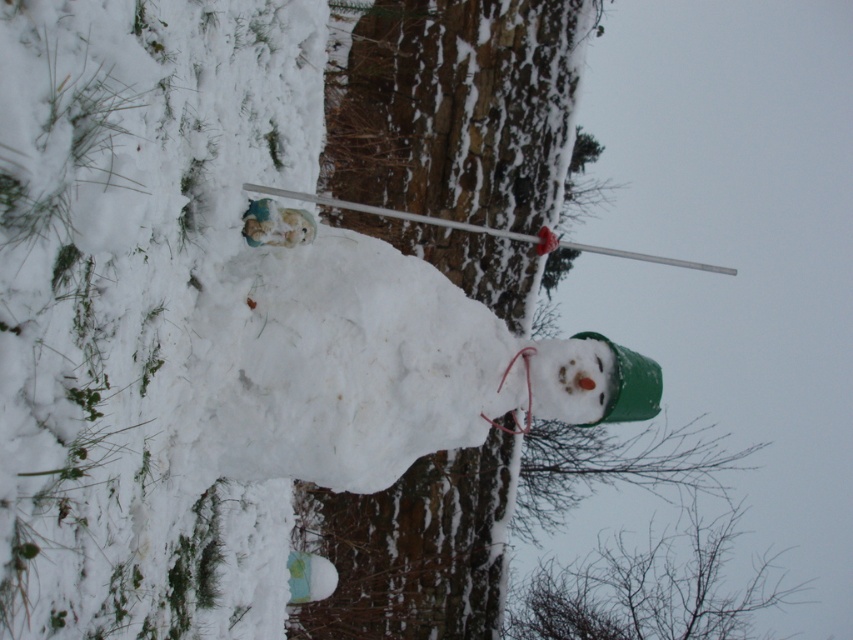
Is green matte snowman at center taller than silvery branches at lower right?

Yes, green matte snowman at center is taller than silvery branches at lower right.

Who is lower down, green matte snowman at center or silvery branches at lower right?

silvery branches at lower right is lower down.

What do you see at coordinates (457, 108) in the screenshot? The width and height of the screenshot is (853, 640). I see `green matte snowman at center` at bounding box center [457, 108].

Locate an element on the screen. green matte snowman at center is located at coordinates (457, 108).

This screenshot has width=853, height=640. What do you see at coordinates (648, 586) in the screenshot?
I see `silvery branches at lower right` at bounding box center [648, 586].

Looking at this image, between silvery branches at lower right and white plastic ski pole at upper center, which one is positioned lower?

silvery branches at lower right

Is point (614, 637) closer to camera compared to point (277, 189)?

No, it is not.

Where is `silvery branches at lower right`? Image resolution: width=853 pixels, height=640 pixels. silvery branches at lower right is located at coordinates (648, 586).

Who is positioned more to the left, green matte snowman at center or white plastic ski pole at upper center?

green matte snowman at center

Looking at this image, does green matte snowman at center appear under white plastic ski pole at upper center?

Correct, green matte snowman at center is located below white plastic ski pole at upper center.

Is point (372, 589) closer to viewer compared to point (473, 225)?

Yes, point (372, 589) is in front of point (473, 225).

Image resolution: width=853 pixels, height=640 pixels. I want to click on green matte snowman at center, so click(457, 108).